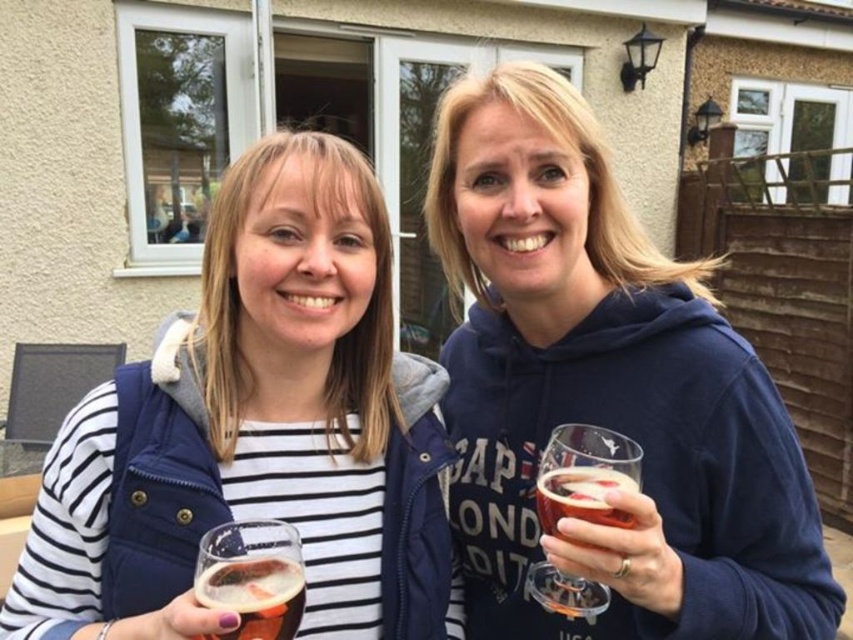
Measure the distance from translucent glass at right to translucent glass beer at center.

translucent glass at right is 11.87 inches away from translucent glass beer at center.

Is translucent glass at right to the right of translucent glass beer at center from the viewer's perspective?

Yes, translucent glass at right is to the right of translucent glass beer at center.

What do you see at coordinates (585, 476) in the screenshot? I see `translucent glass at right` at bounding box center [585, 476].

Locate an element on the screen. translucent glass at right is located at coordinates (585, 476).

Can you confirm if blue cotton hoodie at center is wider than translucent glass beer at center?

Yes, blue cotton hoodie at center is wider than translucent glass beer at center.

From the picture: Does blue cotton hoodie at center have a larger size compared to translucent glass beer at center?

Correct, blue cotton hoodie at center is larger in size than translucent glass beer at center.

Image resolution: width=853 pixels, height=640 pixels. Describe the element at coordinates (605, 392) in the screenshot. I see `blue cotton hoodie at center` at that location.

Image resolution: width=853 pixels, height=640 pixels. In order to click on blue cotton hoodie at center in this screenshot , I will do `click(605, 392)`.

Is white striped shirt at center thinner than translucent glass beer at center?

Incorrect, white striped shirt at center's width is not less than translucent glass beer at center's.

Is point (323, 484) in front of point (219, 563)?

No, it is not.

The height and width of the screenshot is (640, 853). Identify the location of white striped shirt at center. (260, 428).